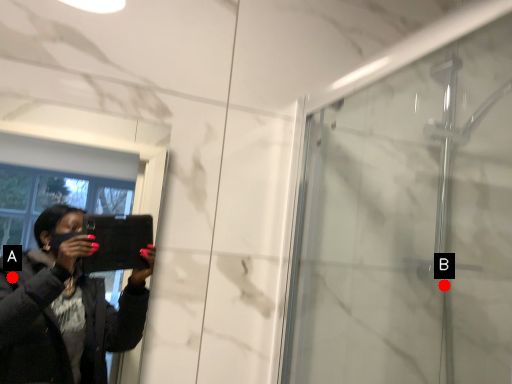
Question: Two points are circled on the image, labeled by A and B beside each circle. Which point is farther from the camera taking this photo?

Choices:
 (A) A is further
 (B) B is further

Answer: (A)